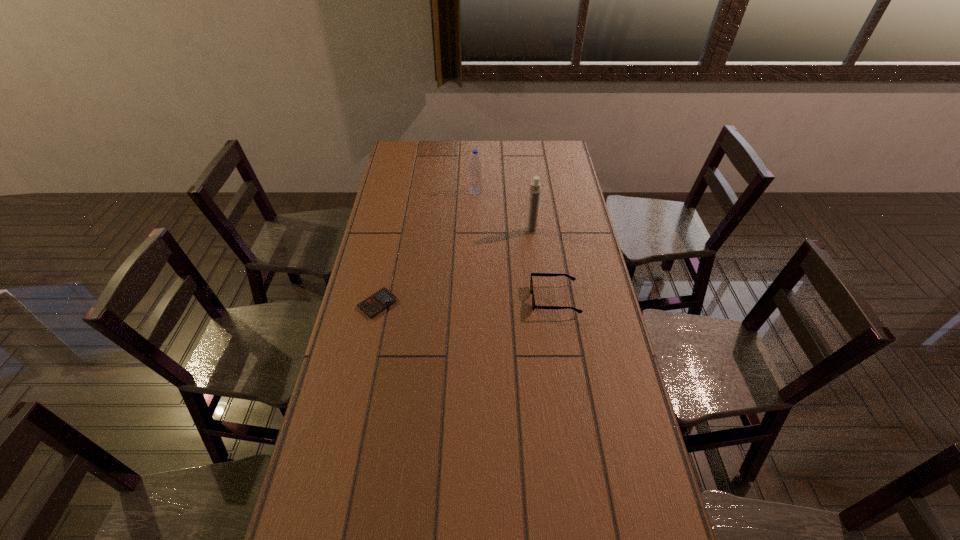
This screenshot has width=960, height=540. What are the coordinates of `vacant space that is in between the third tallest object and the shortest object` in the screenshot? It's located at (466, 301).

The image size is (960, 540). What are the coordinates of `free space that is in between the tallest object and the leftmost object` in the screenshot? It's located at (454, 267).

Find the location of a particular element. Image resolution: width=960 pixels, height=540 pixels. vacant space that is in between the leftmost object and the third nearest object is located at coordinates (454, 267).

Find the location of a particular element. The width and height of the screenshot is (960, 540). free space that is in between the calculator and the second farthest object is located at coordinates (454, 267).

You are a GUI agent. You are given a task and a screenshot of the screen. Output one action in this format:
    pyautogui.click(x=<x>, y=<y>)
    Task: Click on the vacant area that lies between the farthest object and the leftmost object
    The width and height of the screenshot is (960, 540).
    Given the screenshot: What is the action you would take?
    pyautogui.click(x=426, y=247)

The height and width of the screenshot is (540, 960). I want to click on blank region between the spectacles and the tallest object, so click(x=542, y=265).

Image resolution: width=960 pixels, height=540 pixels. What are the coordinates of `vacant area that lies between the farthest object and the shortest object` in the screenshot? It's located at (426, 247).

Image resolution: width=960 pixels, height=540 pixels. Identify the location of vacant space in between the shortest object and the third tallest object. (466, 301).

Where is `vacant point located between the third nearest object and the third shortest object`? vacant point located between the third nearest object and the third shortest object is located at coordinates (503, 211).

I want to click on free space that is in between the calculator and the spectacles, so click(x=466, y=301).